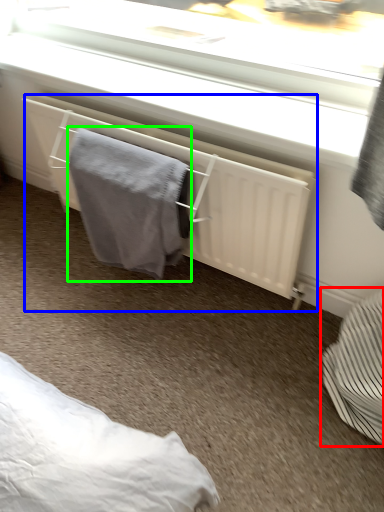
Question: Estimate the real-world distances between objects in this image. Which object is closer to furniture (highlighted by a red box), radiator (highlighted by a blue box) or bath towel (highlighted by a green box)?

Choices:
 (A) radiator
 (B) bath towel

Answer: (A)